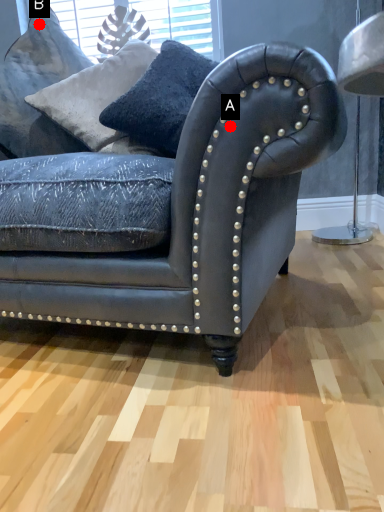
Question: Two points are circled on the image, labeled by A and B beside each circle. Which point is closer to the camera?

Choices:
 (A) A is closer
 (B) B is closer

Answer: (A)